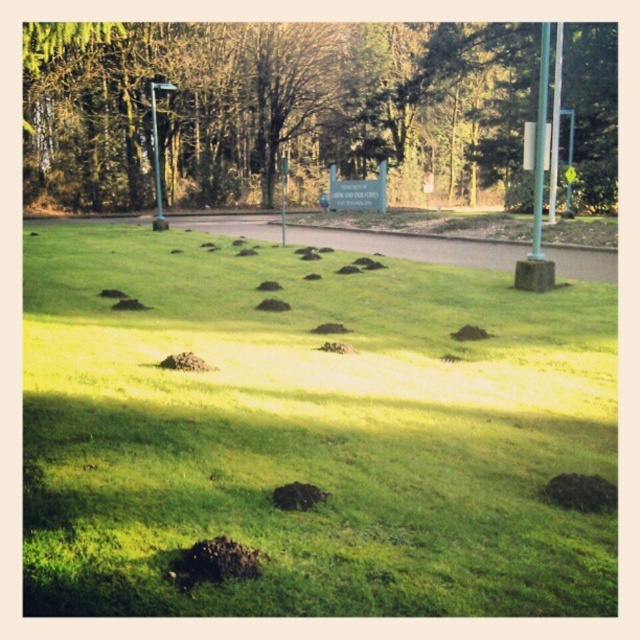
Question: Can you confirm if dark brown dirt mounds at center is positioned above green leafy tree at center?

Choices:
 (A) no
 (B) yes

Answer: (A)

Question: Can you confirm if dark brown dirt mounds at center is positioned above green leafy tree at center?

Choices:
 (A) no
 (B) yes

Answer: (A)

Question: Which point is closer to the camera?

Choices:
 (A) dark brown dirt mounds at center
 (B) green leafy tree at center

Answer: (A)

Question: Which object appears closest to the camera in this image?

Choices:
 (A) green leafy tree at center
 (B) dark brown dirt mounds at center

Answer: (B)

Question: Is dark brown dirt mounds at center closer to camera compared to green leafy tree at center?

Choices:
 (A) no
 (B) yes

Answer: (B)

Question: Which object appears closest to the camera in this image?

Choices:
 (A) green leafy tree at center
 (B) dark brown dirt mounds at center

Answer: (B)